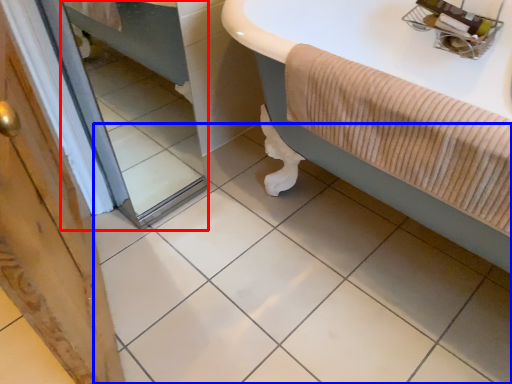
Question: Which point is closer to the camera, mirror (highlighted by a red box) or ceramic tile (highlighted by a blue box)?

Choices:
 (A) mirror
 (B) ceramic tile

Answer: (B)